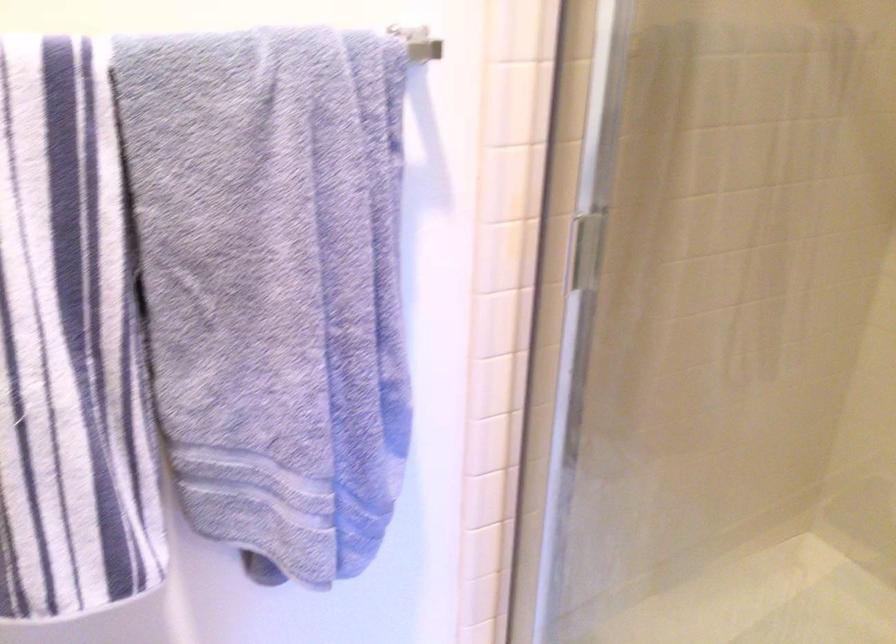
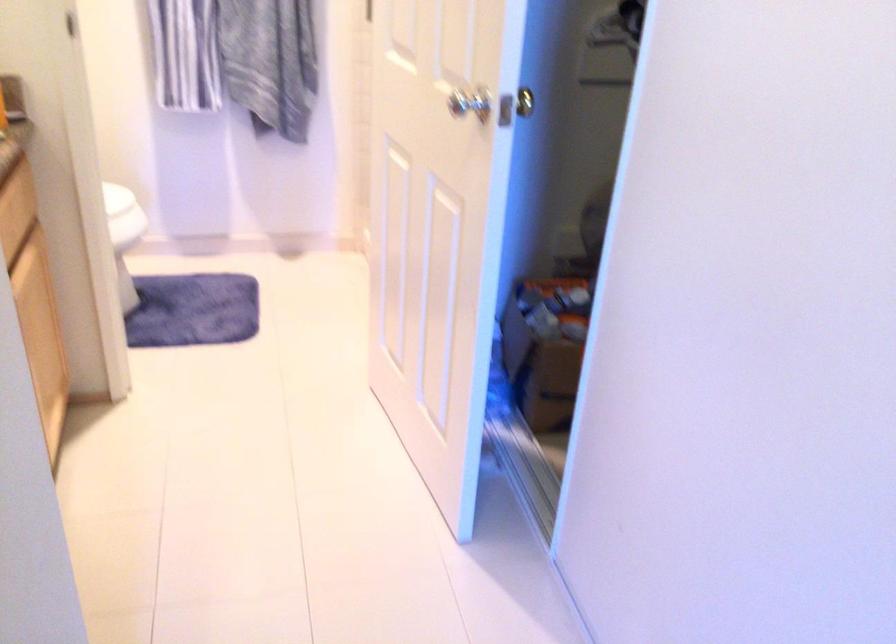
The images are taken continuously from a first-person perspective. In which direction are you moving?

The cameraman walked toward right, backward.